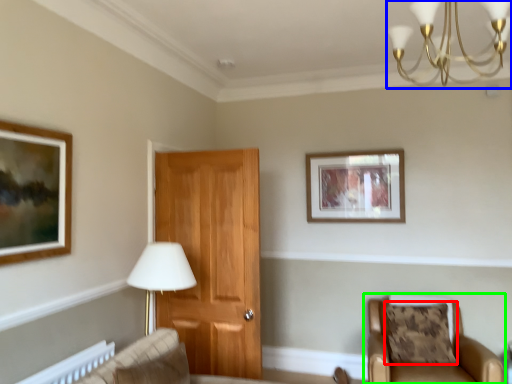
Question: Considering the real-world distances, which object is closest to pillow (highlighted by a red box)? light fixture (highlighted by a blue box) or chair (highlighted by a green box).

Choices:
 (A) light fixture
 (B) chair

Answer: (B)